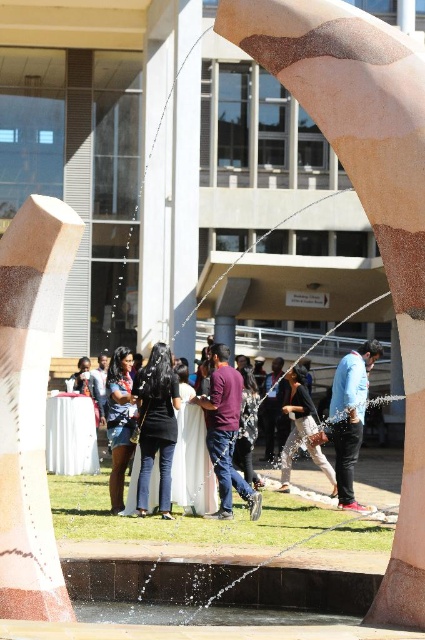
Question: Which object appears farthest from the camera in this image?

Choices:
 (A) matte black dress at center
 (B) matte black shirt at center

Answer: (B)

Question: Where is matte black dress at center located in relation to matte black jacket at center in the image?

Choices:
 (A) left
 (B) right

Answer: (A)

Question: Can you confirm if black matte pants at center is positioned below blue denim jeans at center?

Choices:
 (A) yes
 (B) no

Answer: (A)

Question: Among these points, which one is farthest from the camera?

Choices:
 (A) coord(150,428)
 (B) coord(119,461)
 (C) coord(345,387)

Answer: (C)

Question: Does maroon fabric shirt at center have a smaller size compared to blue denim jeans at center?

Choices:
 (A) yes
 (B) no

Answer: (B)

Question: Which point is farther to the camera?

Choices:
 (A) (144, 490)
 (B) (116, 392)

Answer: (B)